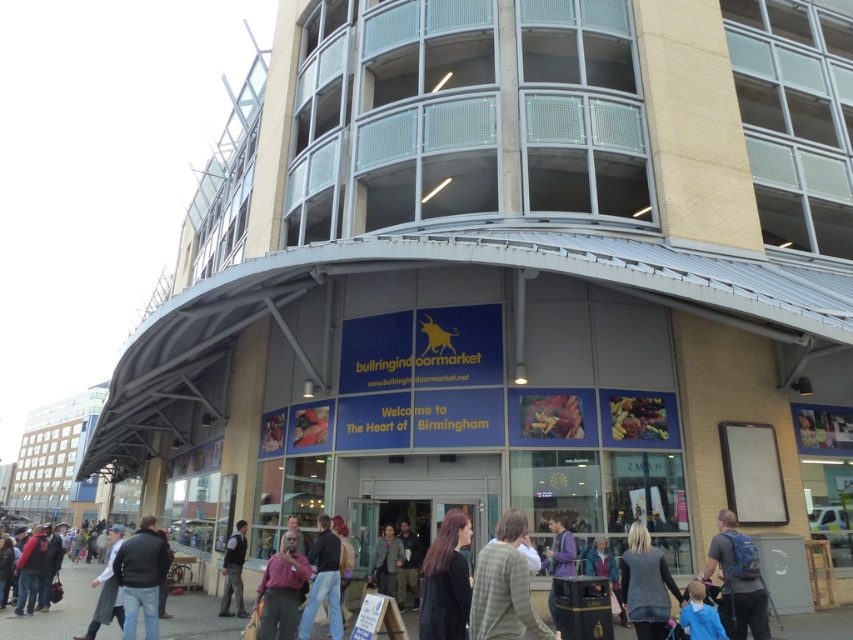
Question: Can you confirm if blue backpack at lower right is positioned to the left of matte purple shirt at lower center?

Choices:
 (A) yes
 (B) no

Answer: (B)

Question: Which point appears farthest from the camera in this image?

Choices:
 (A) (631, 563)
 (B) (331, 625)

Answer: (B)

Question: Is blue backpack at lower right bigger than white shirt at lower left?

Choices:
 (A) yes
 (B) no

Answer: (B)

Question: Is white shirt at lower left smaller than dark gray vest at center?

Choices:
 (A) yes
 (B) no

Answer: (B)

Question: Which object is closer to the camera taking this photo?

Choices:
 (A) white shirt at lower left
 (B) dark gray wool coat at center
 (C) blue backpack at lower right
 (D) khaki fabric jacket at center

Answer: (C)

Question: Which object appears farthest from the camera in this image?

Choices:
 (A) jeans at center
 (B) matte purple shirt at lower center
 (C) light brown leather jacket at center

Answer: (C)